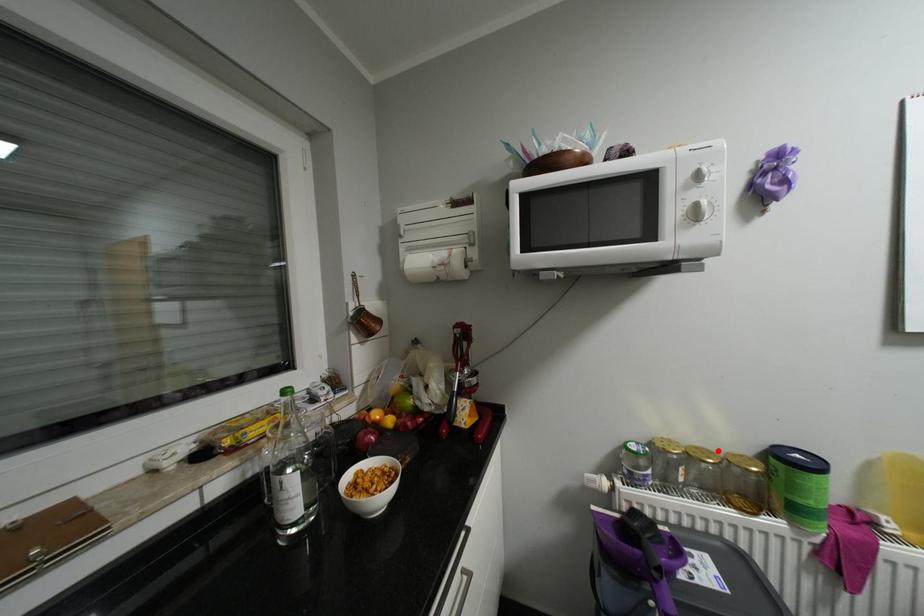
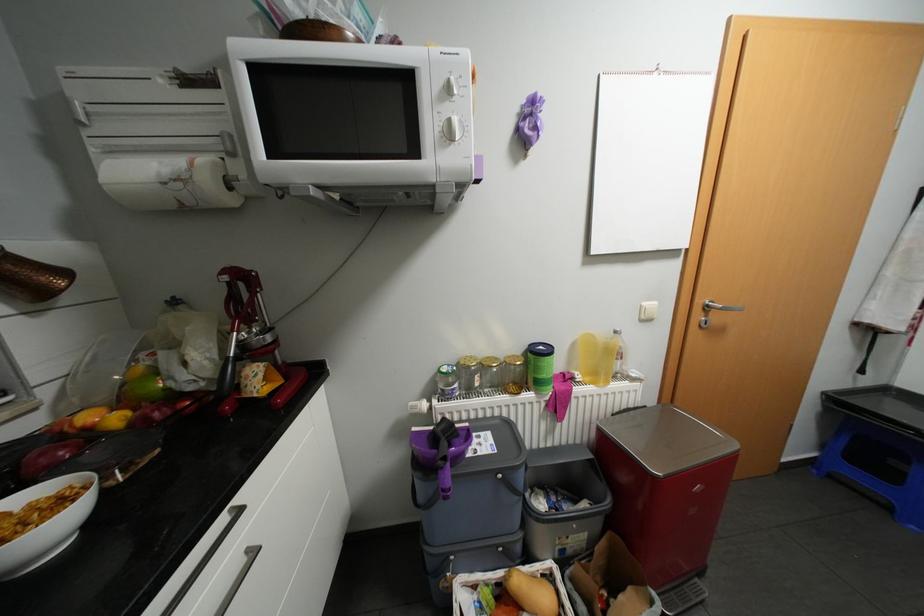
Locate, in the second image, the point that corresponds to the highlighted location in the first image.

(504, 358)